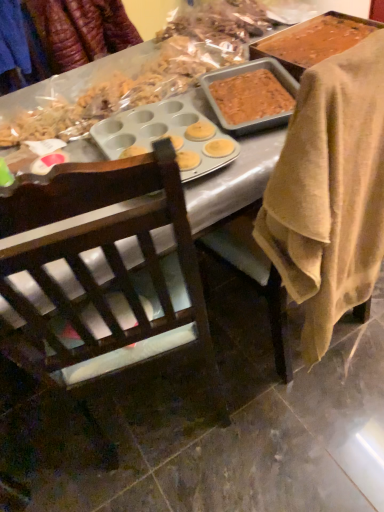
Question: From a real-world perspective, is blue fabric at upper left on brown wooden chair at center, which is counted as the second chair, starting from the left?

Choices:
 (A) no
 (B) yes

Answer: (B)

Question: Is blue fabric at upper left wider than brown wooden chair at center, marked as the first chair in a right-to-left arrangement?

Choices:
 (A) no
 (B) yes

Answer: (A)

Question: Is blue fabric at upper left located outside brown wooden chair at center, marked as the first chair in a right-to-left arrangement?

Choices:
 (A) yes
 (B) no

Answer: (A)

Question: Considering the relative positions of blue fabric at upper left and brown wooden chair at center, marked as the first chair in a right-to-left arrangement, in the image provided, is blue fabric at upper left to the right of brown wooden chair at center, marked as the first chair in a right-to-left arrangement, from the viewer's perspective?

Choices:
 (A) no
 (B) yes

Answer: (A)

Question: Considering the relative sizes of blue fabric at upper left and brown wooden chair at center, marked as the first chair in a right-to-left arrangement, in the image provided, is blue fabric at upper left taller than brown wooden chair at center, marked as the first chair in a right-to-left arrangement,?

Choices:
 (A) yes
 (B) no

Answer: (B)

Question: Does blue fabric at upper left appear on the left side of brown wooden chair at center, which is counted as the second chair, starting from the left?

Choices:
 (A) yes
 (B) no

Answer: (A)

Question: Is blue fabric at upper left to the right of dark wood chair at center, arranged as the first chair when viewed from the left, from the viewer's perspective?

Choices:
 (A) no
 (B) yes

Answer: (A)

Question: Does blue fabric at upper left lie in front of dark wood chair at center, which is counted as the 2th chair, starting from the right?

Choices:
 (A) no
 (B) yes

Answer: (A)

Question: Is blue fabric at upper left placed right next to dark wood chair at center, which is counted as the 2th chair, starting from the right?

Choices:
 (A) no
 (B) yes

Answer: (A)

Question: Is blue fabric at upper left wider than dark wood chair at center, arranged as the first chair when viewed from the left?

Choices:
 (A) no
 (B) yes

Answer: (A)

Question: Is blue fabric at upper left not near dark wood chair at center, arranged as the first chair when viewed from the left?

Choices:
 (A) yes
 (B) no

Answer: (A)

Question: Is blue fabric at upper left not inside dark wood chair at center, which is counted as the 2th chair, starting from the right?

Choices:
 (A) yes
 (B) no

Answer: (A)

Question: Are dark wood chair at center, arranged as the first chair when viewed from the left, and blue fabric at upper left located far from each other?

Choices:
 (A) yes
 (B) no

Answer: (A)